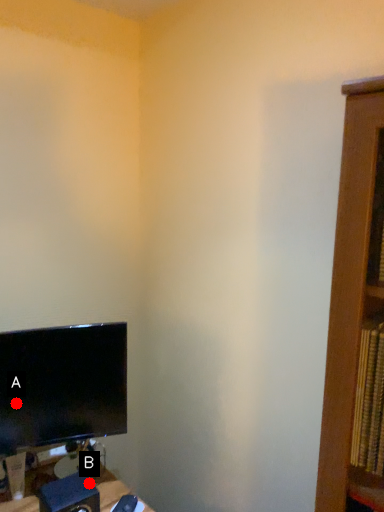
Question: Two points are circled on the image, labeled by A and B beside each circle. Which point is closer to the camera?

Choices:
 (A) A is closer
 (B) B is closer

Answer: (B)